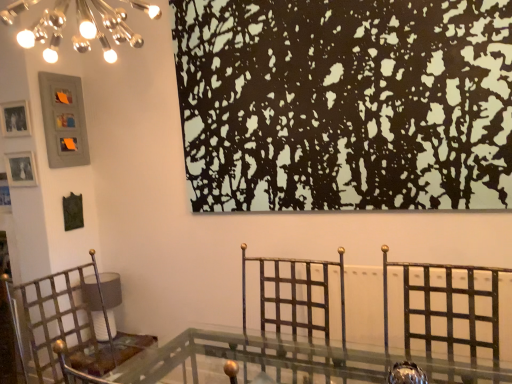
Question: Does black matte painting at upper center have a greater height compared to metallic/golden chair at left?

Choices:
 (A) no
 (B) yes

Answer: (B)

Question: Does black matte painting at upper center come behind metallic/golden chair at left?

Choices:
 (A) yes
 (B) no

Answer: (A)

Question: From the image's perspective, is black matte painting at upper center over metallic/golden chair at left?

Choices:
 (A) yes
 (B) no

Answer: (A)

Question: Is the position of black matte painting at upper center less distant than that of metallic/golden chair at left?

Choices:
 (A) yes
 (B) no

Answer: (B)

Question: Can you confirm if black matte painting at upper center is bigger than metallic/golden chair at left?

Choices:
 (A) no
 (B) yes

Answer: (B)

Question: Considering the relative sizes of black matte painting at upper center and metallic/golden chair at left in the image provided, is black matte painting at upper center thinner than metallic/golden chair at left?

Choices:
 (A) no
 (B) yes

Answer: (B)

Question: Considering the relative positions of metallic gold swivel chair at center and matte gray picture frame at upper left, marked as the first picture frame in a top-to-bottom arrangement, in the image provided, is metallic gold swivel chair at center to the left of matte gray picture frame at upper left, marked as the first picture frame in a top-to-bottom arrangement, from the viewer's perspective?

Choices:
 (A) yes
 (B) no

Answer: (B)

Question: Are metallic gold swivel chair at center and matte gray picture frame at upper left, the 3th picture frame in the bottom-to-top sequence, making contact?

Choices:
 (A) no
 (B) yes

Answer: (A)

Question: Is matte gray picture frame at upper left, marked as the first picture frame in a top-to-bottom arrangement, at the back of metallic gold swivel chair at center?

Choices:
 (A) no
 (B) yes

Answer: (A)

Question: From the image's perspective, does metallic gold swivel chair at center appear lower than matte gray picture frame at upper left, marked as the first picture frame in a top-to-bottom arrangement?

Choices:
 (A) no
 (B) yes

Answer: (B)

Question: Can you confirm if metallic gold swivel chair at center is shorter than matte gray picture frame at upper left, marked as the first picture frame in a top-to-bottom arrangement?

Choices:
 (A) yes
 (B) no

Answer: (A)

Question: Considering the relative sizes of metallic gold swivel chair at center and matte gray picture frame at upper left, the 3th picture frame in the bottom-to-top sequence, in the image provided, is metallic gold swivel chair at center taller than matte gray picture frame at upper left, the 3th picture frame in the bottom-to-top sequence,?

Choices:
 (A) no
 (B) yes

Answer: (A)

Question: Does matte gray picture frame at upper left, the 3th picture frame in the bottom-to-top sequence, touch metallic gold swivel chair at center?

Choices:
 (A) yes
 (B) no

Answer: (B)